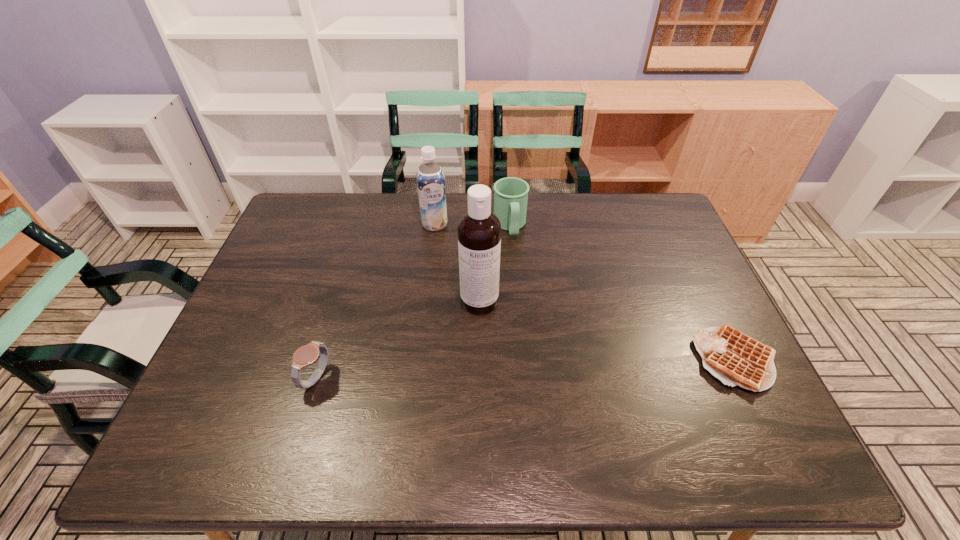
Identify the location of vacant space at the far left corner. This screenshot has width=960, height=540. (322, 220).

Where is `vacant space in between the fourth shortest object and the rightmost object`? The width and height of the screenshot is (960, 540). vacant space in between the fourth shortest object and the rightmost object is located at coordinates (586, 292).

Find the location of a particular element. This screenshot has width=960, height=540. free spot between the mug and the fourth tallest object is located at coordinates pyautogui.click(x=414, y=302).

Where is `blank region between the third nearest object and the waffle`? The image size is (960, 540). blank region between the third nearest object and the waffle is located at coordinates (609, 331).

The image size is (960, 540). I want to click on vacant region between the fourth tallest object and the shortest object, so click(527, 369).

Locate an element on the screen. This screenshot has height=540, width=960. empty space between the waffle and the tallest object is located at coordinates (609, 331).

Find the location of a particular element. free spot between the fourth object from right to left and the second shortest object is located at coordinates (376, 301).

You are a GUI agent. You are given a task and a screenshot of the screen. Output one action in this format:
    pyautogui.click(x=<x>, y=<y>)
    Task: Click on the object that ranks as the second closest to the tallest object
    
    Given the screenshot: What is the action you would take?
    pyautogui.click(x=430, y=178)

This screenshot has width=960, height=540. Identify the location of the fourth closest object to the second shortest object. (734, 358).

I want to click on free space that satisfies the following two spatial constraints: 1. on the back side of the tallest object; 2. on the left side of the second shortest object, so click(340, 301).